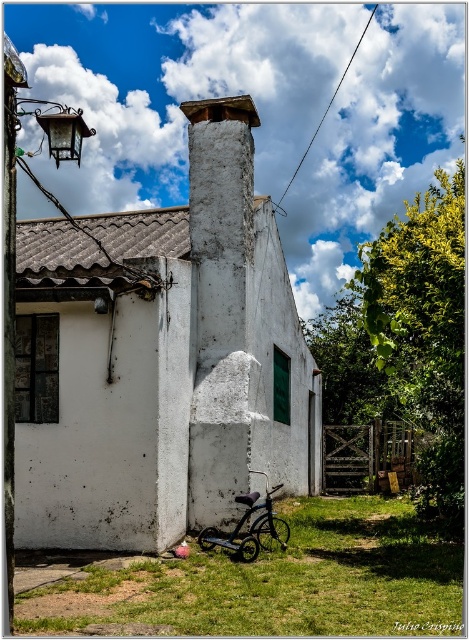
Who is more forward, (212, 410) or (248, 516)?

Point (248, 516)

Between point (216, 209) and point (274, 538), which one is positioned behind?

The point (216, 209) is more distant.

You are a GUI agent. You are given a task and a screenshot of the screen. Output one action in this format:
    pyautogui.click(x=<x>, y=<y>)
    Task: Click on the white rough concrete chimney at center
    This screenshot has width=469, height=640.
    Given the screenshot: What is the action you would take?
    pyautogui.click(x=222, y=308)

Which is below, green grass at lower center or shiny black bicycle at lower center?

green grass at lower center is lower down.

Is green grass at lower center above shiny black bicycle at lower center?

No, green grass at lower center is not above shiny black bicycle at lower center.

Between point (157, 620) and point (258, 529), which one is positioned behind?

Point (258, 529)

The image size is (469, 640). Find the location of `green grass at lower center`. green grass at lower center is located at coordinates (277, 582).

Does green grass at lower center come behind white rough concrete chimney at center?

No, green grass at lower center is in front of white rough concrete chimney at center.

Which is in front, point (458, 561) or point (198, 106)?

Point (458, 561) is more forward.

Find the location of a particular element. Image resolution: width=469 pixels, height=640 pixels. green grass at lower center is located at coordinates (277, 582).